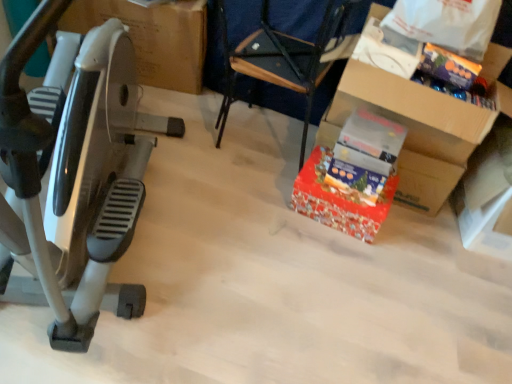
Image resolution: width=512 pixels, height=384 pixels. Identify the location of silver metallic stationary bicycle at left. (73, 176).

Describe the element at coordinates (338, 200) in the screenshot. I see `red glossy gift at center, which is the second gift in right-to-left order` at that location.

Locate an element on the screen. The image size is (512, 384). blue fabric armchair at center is located at coordinates (282, 58).

What do you see at coordinates (448, 66) in the screenshot? I see `shiny purple candy at upper right, marked as the 2th gift in a bottom-to-top arrangement` at bounding box center [448, 66].

In order to face matte cardboard box at left, placed as the 1th cardboard box when sorted from back to front, should I rotate leftwards or rightwards?

You should look left and rotate roughly 14.816 degrees.

Find the location of `cardboard box at right, the 1th cardboard box when ordered from right to left`. cardboard box at right, the 1th cardboard box when ordered from right to left is located at coordinates (412, 130).

Who is bigger, blue fabric armchair at center or matte cardboard box at left, placed as the 1th cardboard box when sorted from back to front?

matte cardboard box at left, placed as the 1th cardboard box when sorted from back to front, is bigger.

Is blue fabric armchair at center surrounding matte cardboard box at left, placed as the 1th cardboard box when sorted from back to front?

Actually, matte cardboard box at left, placed as the 1th cardboard box when sorted from back to front, is outside blue fabric armchair at center.

Considering their positions, is blue fabric armchair at center located in front of or behind matte cardboard box at left, the first cardboard box when ordered from left to right?

blue fabric armchair at center is in front of matte cardboard box at left, the first cardboard box when ordered from left to right.

Is blue fabric armchair at center not close to matte cardboard box at left, which is counted as the 2th cardboard box, starting from the front?

No, blue fabric armchair at center is in close proximity to matte cardboard box at left, which is counted as the 2th cardboard box, starting from the front.

Is cardboard box at right, which is counted as the first cardboard box, starting from the front, positioned beyond the bounds of blue fabric armchair at center?

Yes, cardboard box at right, which is counted as the first cardboard box, starting from the front, is outside of blue fabric armchair at center.

From a real-world perspective, is cardboard box at right, the 2th cardboard box viewed from the back, physically above blue fabric armchair at center?

Yes, from a real-world perspective, cardboard box at right, the 2th cardboard box viewed from the back, is above blue fabric armchair at center.

Is point (400, 102) positioned before point (296, 68)?

Yes, point (400, 102) is closer to viewer.

Is cardboard box at right, the second cardboard box in the left-to-right sequence, further to the viewer compared to blue fabric armchair at center?

Yes, the depth of cardboard box at right, the second cardboard box in the left-to-right sequence, is greater than that of blue fabric armchair at center.

Visually, is white cardboard box at right positioned to the left or to the right of matte cardboard box at left, placed as the 1th cardboard box when sorted from back to front?

white cardboard box at right is positioned on matte cardboard box at left, placed as the 1th cardboard box when sorted from back to front,'s right side.

Find the location of a particular element. cardboard box that is the 2nd one when counting upward from the white cardboard box at right (from the image's perspective) is located at coordinates (153, 37).

Is point (487, 146) less distant than point (89, 1)?

That is True.

How far apart are white cardboard box at right and matte cardboard box at left, which is counted as the 2th cardboard box, starting from the front?

white cardboard box at right and matte cardboard box at left, which is counted as the 2th cardboard box, starting from the front, are 5.09 feet apart.

Can we say matte cardboard box at left, the first cardboard box when ordered from left to right, lies outside blue fabric armchair at center?

That's correct, matte cardboard box at left, the first cardboard box when ordered from left to right, is outside of blue fabric armchair at center.

Which of these two, matte cardboard box at left, which is counted as the 2th cardboard box, starting from the front, or blue fabric armchair at center, is bigger?

matte cardboard box at left, which is counted as the 2th cardboard box, starting from the front.

Are matte cardboard box at left, placed as the 1th cardboard box when sorted from back to front, and blue fabric armchair at center far apart?

No.

In the image, there is a blue fabric armchair at center. Identify the location of cardboard box above it (from the image's perspective). (153, 37).

From the image's perspective, is shiny purple candy at upper right, marked as the 2th gift in a bottom-to-top arrangement, located beneath white cardboard box at right?

No, from the image's perspective, shiny purple candy at upper right, marked as the 2th gift in a bottom-to-top arrangement, is not below white cardboard box at right.

Can we say shiny purple candy at upper right, marked as the 2th gift in a bottom-to-top arrangement, lies outside white cardboard box at right?

That's correct, shiny purple candy at upper right, marked as the 2th gift in a bottom-to-top arrangement, is outside of white cardboard box at right.

Can you confirm if shiny purple candy at upper right, marked as the 2th gift in a bottom-to-top arrangement, is taller than white cardboard box at right?

In fact, shiny purple candy at upper right, marked as the 2th gift in a bottom-to-top arrangement, may be shorter than white cardboard box at right.

Which of these two, silver metallic stationary bicycle at left or white cardboard box at right, stands taller?

silver metallic stationary bicycle at left.

Image resolution: width=512 pixels, height=384 pixels. Find the location of `box that appears below the silver metallic stationary bicycle at left (from the image's perspective)`. box that appears below the silver metallic stationary bicycle at left (from the image's perspective) is located at coordinates (487, 196).

Is silver metallic stationary bicycle at left wider than white cardboard box at right?

Correct, the width of silver metallic stationary bicycle at left exceeds that of white cardboard box at right.

From a real-world perspective, who is located higher, silver metallic stationary bicycle at left or white cardboard box at right?

silver metallic stationary bicycle at left is physically above.

The image size is (512, 384). In order to click on the 1st gift behind the blue fabric armchair at center, counting from the anchor's position in this screenshot , I will do `click(448, 66)`.

Measure the distance from shiny purple candy at upper right, which appears as the second gift when viewed from the left, to blue fabric armchair at center.

A distance of 23.90 inches exists between shiny purple candy at upper right, which appears as the second gift when viewed from the left, and blue fabric armchair at center.

From the image's perspective, which one is positioned higher, shiny purple candy at upper right, marked as the 2th gift in a bottom-to-top arrangement, or blue fabric armchair at center?

blue fabric armchair at center appears higher in the image.

Is shiny purple candy at upper right, marked as the 2th gift in a bottom-to-top arrangement, oriented away from blue fabric armchair at center?

shiny purple candy at upper right, marked as the 2th gift in a bottom-to-top arrangement, does not have its back to blue fabric armchair at center.

Locate an element on the screen. This screenshot has width=512, height=384. cardboard box on the left of blue fabric armchair at center is located at coordinates [153, 37].

At what (x,y) coordinates should I click in order to perform the action: click on cardboard box below the blue fabric armchair at center (from the image's perspective). Please return your answer as a coordinate pair (x, y). This screenshot has height=384, width=512. Looking at the image, I should click on 412,130.

Which object lies nearer to the anchor point shiny purple candy at upper right, the first gift from the right, matte cardboard box at left, placed as the 1th cardboard box when sorted from back to front, or cardboard box at right, the 2th cardboard box viewed from the back?

cardboard box at right, the 2th cardboard box viewed from the back, is closer to shiny purple candy at upper right, the first gift from the right.

Based on their spatial positions, is blue fabric armchair at center or matte cardboard box at left, which is counted as the 2th cardboard box, starting from the front, closer to red glossy gift at center, positioned as the 1th gift in bottom-to-top order?

Based on the image, blue fabric armchair at center appears to be nearer to red glossy gift at center, positioned as the 1th gift in bottom-to-top order.

Looking at the image, which one is located closer to white cardboard box at right, matte cardboard box at left, arranged as the second cardboard box when viewed from the right, or red glossy gift at center, which is the second gift in right-to-left order?

The object closer to white cardboard box at right is red glossy gift at center, which is the second gift in right-to-left order.

Looking at the image, which one is located closer to shiny purple candy at upper right, acting as the first gift starting from the top, blue fabric armchair at center or white plastic bag at upper right?

white plastic bag at upper right is closer to shiny purple candy at upper right, acting as the first gift starting from the top.

Based on the photo, when comparing their distances from white cardboard box at right, does red glossy gift at center, which is the second gift in right-to-left order, or matte cardboard box at left, placed as the 1th cardboard box when sorted from back to front, seem further?

Based on the image, matte cardboard box at left, placed as the 1th cardboard box when sorted from back to front, appears to be further to white cardboard box at right.

From the image, which object appears to be farther from blue fabric armchair at center, cardboard box at right, the 2th cardboard box viewed from the back, or shiny purple candy at upper right, the first gift from the right?

shiny purple candy at upper right, the first gift from the right, lies further to blue fabric armchair at center than the other object.

From the image, which object appears to be farther from matte cardboard box at left, placed as the 1th cardboard box when sorted from back to front, red glossy gift at center, the second gift in the top-to-bottom sequence, or silver metallic stationary bicycle at left?

The object further to matte cardboard box at left, placed as the 1th cardboard box when sorted from back to front, is red glossy gift at center, the second gift in the top-to-bottom sequence.

Looking at the image, which one is located closer to silver metallic stationary bicycle at left, matte cardboard box at left, placed as the 1th cardboard box when sorted from back to front, or cardboard box at right, the 2th cardboard box viewed from the back?

The object closer to silver metallic stationary bicycle at left is matte cardboard box at left, placed as the 1th cardboard box when sorted from back to front.

Identify the location of armchair between silver metallic stationary bicycle at left and shiny purple candy at upper right, which appears as the second gift when viewed from the left. (282, 58).

Where is `cardboard box located between red glossy gift at center, which appears as the 1th gift when viewed from the left, and white cardboard box at right in the left-right direction`? cardboard box located between red glossy gift at center, which appears as the 1th gift when viewed from the left, and white cardboard box at right in the left-right direction is located at coordinates 412,130.

This screenshot has width=512, height=384. I want to click on cardboard box between shiny purple candy at upper right, marked as the 2th gift in a bottom-to-top arrangement, and white cardboard box at right in the up-down direction, so click(x=412, y=130).

I want to click on grocery bag between silver metallic stationary bicycle at left and red glossy gift at center, positioned as the 1th gift in bottom-to-top order, in the front-back direction, so click(447, 23).